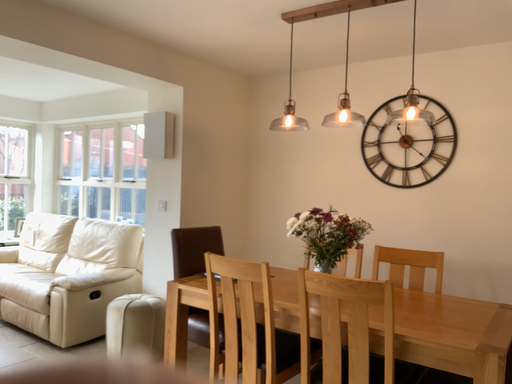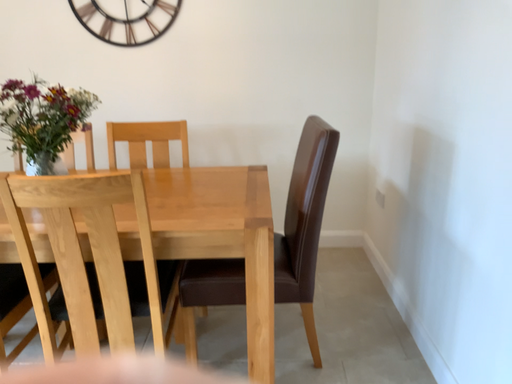
Question: Which way did the camera rotate in the video?

Choices:
 (A) rotated right
 (B) rotated left

Answer: (A)